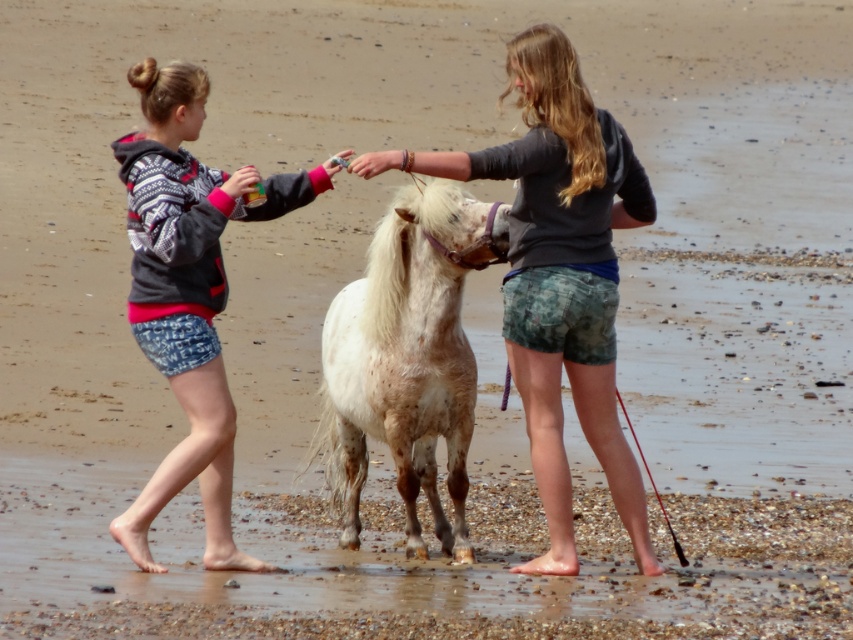
You are standing on the beach and see the spotted white pony at center and the patterned denim shorts at left. Which object is positioned more to the right side of the scene?

The spotted white pony at center is positioned more to the right side of the scene compared to the patterned denim shorts at left.

You are a photographer trying to capture a photo of the spotted white pony at center and the patterned denim shorts at left. Based on their positions, which object is closer to the camera?

The spotted white pony at center is positioned under the patterned denim shorts at left, meaning the pony is closer to the camera than the shorts.

You are a photographer trying to capture the spotted white pony at center and the white speckled fur at center in a single shot. Since you want to ensure both are fully visible, which one should you focus on first to frame them properly?

The spotted white pony at center is taller than the white speckled fur at center, so you should focus on the spotted white pony at center first to ensure it fits within the frame before adjusting for the smaller white speckled fur at center.